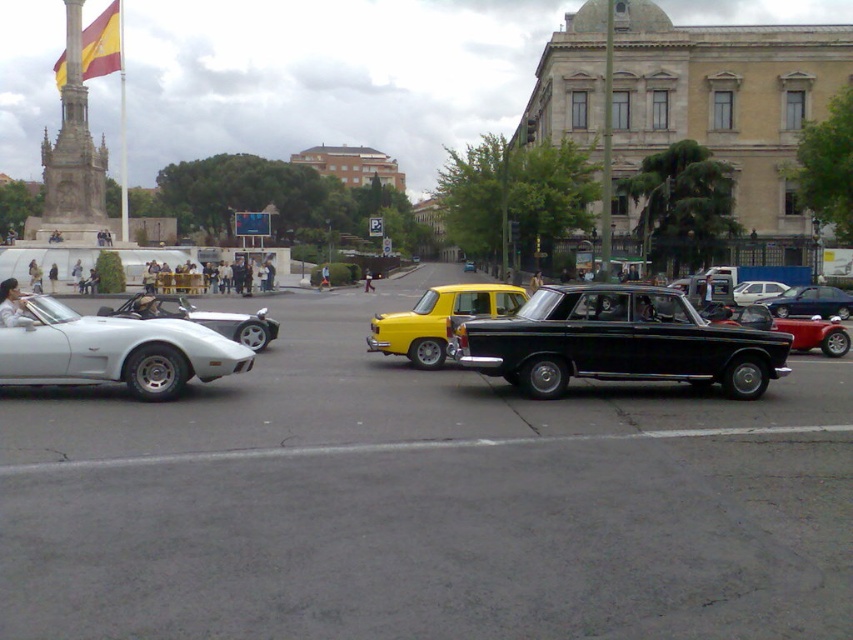
You are a photographer setting up a tripod to take a picture of the white glossy sports car at left and the metallic silver sedan at center. Since you want to capture both vehicles in the same frame, which one should you position closer to the camera to ensure both are fully visible?

The white glossy sports car at left has a lesser height compared to the metallic silver sedan at center. To ensure both are fully visible in the same frame, position the white glossy sports car at left closer to the camera so its smaller size balances with the taller metallic silver sedan at center.

You are a photographer standing on the sidewalk and want to take a picture of the shiny silver sports car at left and the yellow matte taxi at center. Based on their positions, which vehicle will appear higher in your photo?

The shiny silver sports car at left will appear higher in the photo because the yellow matte taxi at center is positioned below it.

You are standing at the point marked by the coordinates point (438, 320) in the image. Which object from the scene is exactly at that location?

The yellow matte taxi at center is located at point (438, 320).